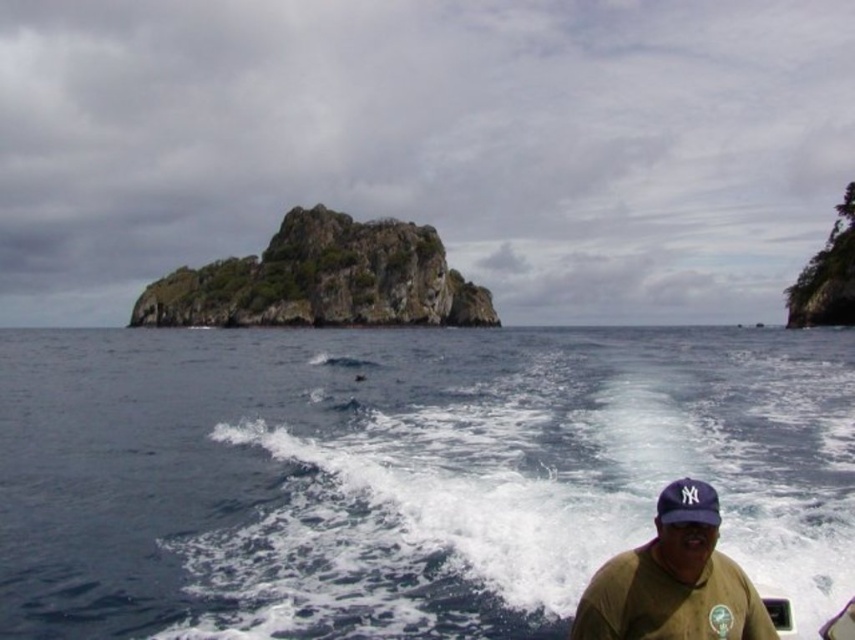
Question: Which of these objects is positioned farthest from the blue water at center?

Choices:
 (A) brown matte shirt at lower right
 (B) blue fabric baseball cap at lower right

Answer: (A)

Question: Can you confirm if blue water at center is bigger than brown matte shirt at lower right?

Choices:
 (A) yes
 (B) no

Answer: (A)

Question: Does blue water at center have a larger size compared to rockymaterial/texture at center?

Choices:
 (A) no
 (B) yes

Answer: (A)

Question: Which of the following is the closest to the observer?

Choices:
 (A) brown matte shirt at lower right
 (B) rockymaterial/texture at center

Answer: (A)

Question: Does blue water at center come in front of brown matte shirt at lower right?

Choices:
 (A) yes
 (B) no

Answer: (B)

Question: Which object is the closest to the brown matte shirt at lower right?

Choices:
 (A) blue fabric baseball cap at lower right
 (B) rockymaterial/texture at center
 (C) blue water at center

Answer: (A)